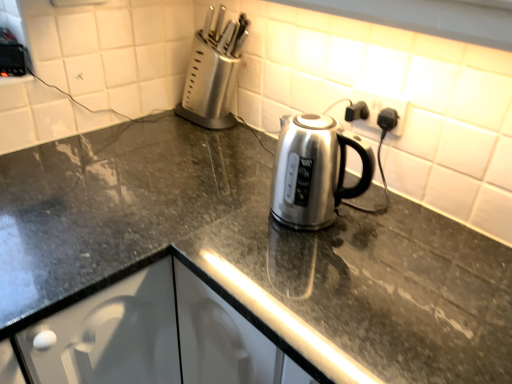
Question: Is black plastic outlet at upper right at the left side of satin silver knife block at upper left?

Choices:
 (A) yes
 (B) no

Answer: (B)

Question: From the image's perspective, is black plastic outlet at upper right beneath satin silver knife block at upper left?

Choices:
 (A) yes
 (B) no

Answer: (A)

Question: Is black plastic outlet at upper right not inside satin silver knife block at upper left?

Choices:
 (A) yes
 (B) no

Answer: (A)

Question: From the image's perspective, is black plastic outlet at upper right over satin silver knife block at upper left?

Choices:
 (A) yes
 (B) no

Answer: (B)

Question: Does black plastic outlet at upper right have a lesser width compared to satin silver knife block at upper left?

Choices:
 (A) no
 (B) yes

Answer: (B)

Question: From a real-world perspective, is satin silver knife block at upper left positioned above or below slate gray granite countertop at center?

Choices:
 (A) below
 (B) above

Answer: (B)

Question: Is satin silver knife block at upper left bigger or smaller than slate gray granite countertop at center?

Choices:
 (A) big
 (B) small

Answer: (B)

Question: From their relative heights in the image, would you say satin silver knife block at upper left is taller or shorter than slate gray granite countertop at center?

Choices:
 (A) tall
 (B) short

Answer: (B)

Question: Is satin silver knife block at upper left wider or thinner than slate gray granite countertop at center?

Choices:
 (A) thin
 (B) wide

Answer: (A)

Question: From the image's perspective, is slate gray granite countertop at center positioned above or below satin silver knife block at upper left?

Choices:
 (A) above
 (B) below

Answer: (B)

Question: Relative to satin silver knife block at upper left, is slate gray granite countertop at center in front or behind?

Choices:
 (A) behind
 (B) front

Answer: (B)

Question: Looking at the image, does slate gray granite countertop at center seem bigger or smaller compared to satin silver knife block at upper left?

Choices:
 (A) big
 (B) small

Answer: (A)

Question: From a real-world perspective, is slate gray granite countertop at center above or below satin silver knife block at upper left?

Choices:
 (A) above
 (B) below

Answer: (B)

Question: Considering their positions, is satin silver knife block at upper left located in front of or behind black plastic outlet at upper right?

Choices:
 (A) front
 (B) behind

Answer: (B)

Question: Does point (x=197, y=112) appear closer or farther from the camera than point (x=397, y=100)?

Choices:
 (A) closer
 (B) farther

Answer: (B)